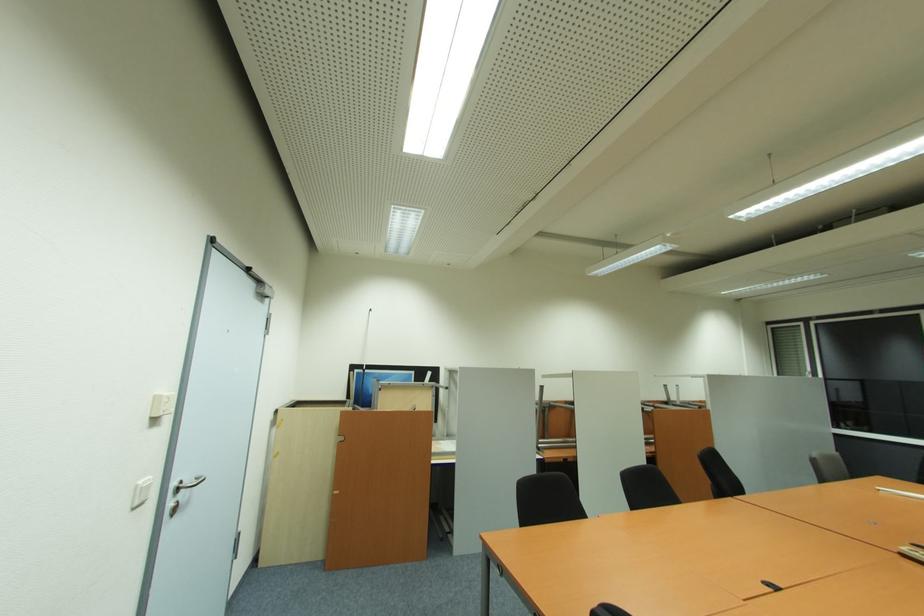
What do you see at coordinates (188, 484) in the screenshot? The image size is (924, 616). I see `the cabinet door handle` at bounding box center [188, 484].